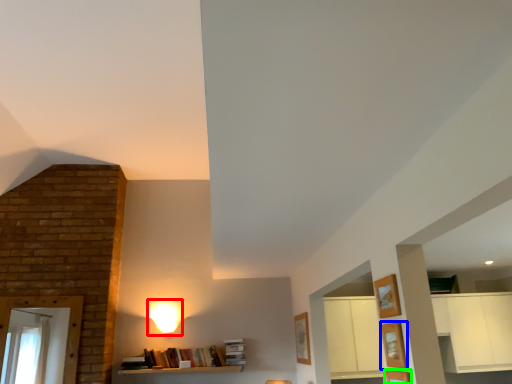
Question: Estimate the real-world distances between objects in this image. Which object is closer to lamp (highlighted by a red box), shelf (highlighted by a blue box) or shelf (highlighted by a green box)?

Choices:
 (A) shelf
 (B) shelf

Answer: (B)